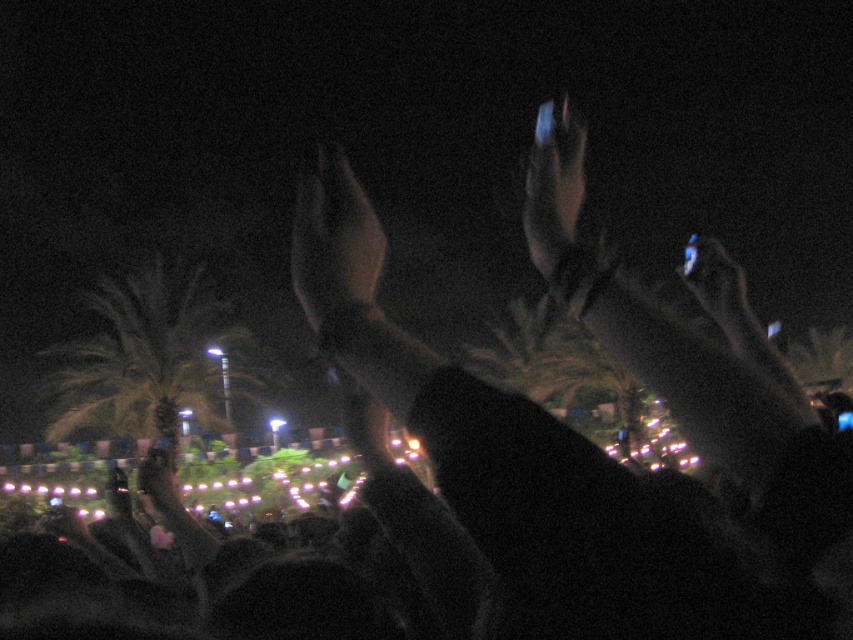
You are standing at the center of the nighttime outdoor scene. You see a matte black hand at center located at point (334, 240). Can you move forward without stepping on the matte black hand at center?

The matte black hand at center is located at point (334, 240), so yes, you can move forward without stepping on it since it is at the center and not on the ground.

From the picture: You are at a nighttime event and see the green leafy palm tree at left and the shiny metallic hand at upper center. Which object is closer to you?

The green leafy palm tree at left is closer to you because it is further to the viewer than the shiny metallic hand at upper center, meaning it appears nearer in the scene.

You are standing in the nighttime outdoor scene with raised hands in front and lights in the background. There is a green leafy palm tree at left represented by point (152, 356). Where would you look to find the green leafy palm tree at left?

Result: The green leafy palm tree at left is located at the coordinates (152, 356).